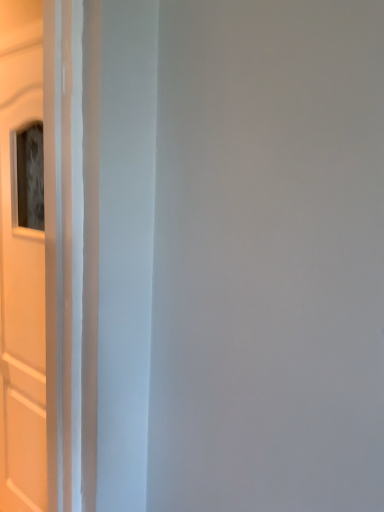
The width and height of the screenshot is (384, 512). I want to click on white matte door at left, so click(x=37, y=252).

Describe the element at coordinates (37, 252) in the screenshot. I see `white matte door at left` at that location.

Measure the distance between point (64, 191) and camera.

36.14 inches.

You are a GUI agent. You are given a task and a screenshot of the screen. Output one action in this format:
    pyautogui.click(x=<x>, y=<y>)
    Task: Click on the white matte door at left
    
    Given the screenshot: What is the action you would take?
    pyautogui.click(x=37, y=252)